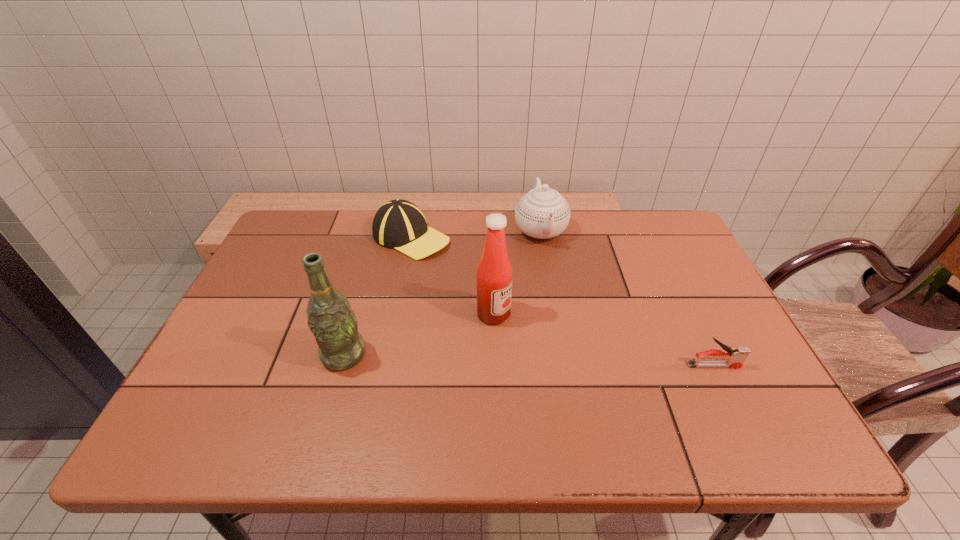
Image resolution: width=960 pixels, height=540 pixels. What are the coordinates of `object that is at the right edge` in the screenshot? It's located at (735, 358).

Image resolution: width=960 pixels, height=540 pixels. What are the coordinates of `vacant region at the far edge` in the screenshot? It's located at (464, 219).

This screenshot has height=540, width=960. Identify the location of vacant space at the near edge of the desktop. (673, 406).

In the image, there is a desktop. At what (x,y) coordinates should I click in order to perform the action: click on vacant space at the left edge. Please return your answer as a coordinate pair (x, y). This screenshot has height=540, width=960. Looking at the image, I should click on (283, 303).

In the image, there is a desktop. Where is `vacant space at the right edge`? This screenshot has height=540, width=960. vacant space at the right edge is located at coordinates (695, 315).

In the image, there is a desktop. What are the coordinates of `vacant space at the far right corner` in the screenshot? It's located at (660, 244).

What are the coordinates of `vacant space that is in between the condiment and the baseball cap` in the screenshot? It's located at [x=452, y=276].

The height and width of the screenshot is (540, 960). What are the coordinates of `blank region between the baseball cap and the stapler` in the screenshot? It's located at (563, 301).

I want to click on unoccupied area between the beer bottle and the third tallest object, so click(x=443, y=293).

Where is `free space between the rightmost object and the baseball cap`? The width and height of the screenshot is (960, 540). free space between the rightmost object and the baseball cap is located at coordinates (563, 301).